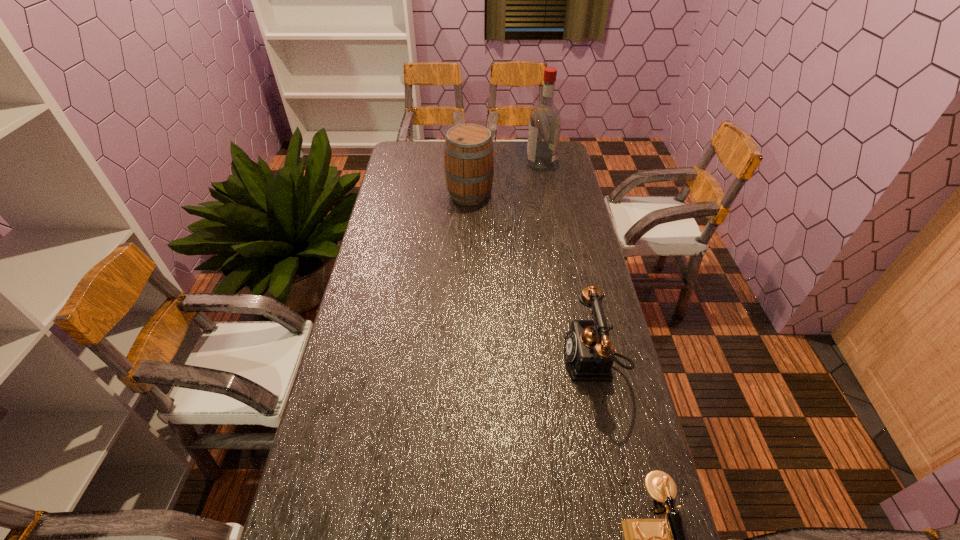
Where is `free spot between the cider and the farthest object`? free spot between the cider and the farthest object is located at coordinates (505, 178).

The height and width of the screenshot is (540, 960). In order to click on blank region between the farthest object and the farther telephone in this screenshot , I will do `click(566, 261)`.

The width and height of the screenshot is (960, 540). In order to click on empty space that is in between the third shortest object and the liquor in this screenshot , I will do `click(505, 178)`.

Locate which object ranks in proximity to the tallest object. Please provide its 2D coordinates. Your answer should be formatted as a tuple, i.e. [(x, y)], where the tuple contains the x and y coordinates of a point satisfying the conditions above.

[(468, 151)]

Find the location of `object that is the third closest to the nearer telephone`. object that is the third closest to the nearer telephone is located at coordinates (545, 121).

Where is `free location that satisfies the following two spatial constraints: 1. on the front-facing side of the tallest object; 2. on the front side of the third shortest object`? Image resolution: width=960 pixels, height=540 pixels. free location that satisfies the following two spatial constraints: 1. on the front-facing side of the tallest object; 2. on the front side of the third shortest object is located at coordinates (546, 193).